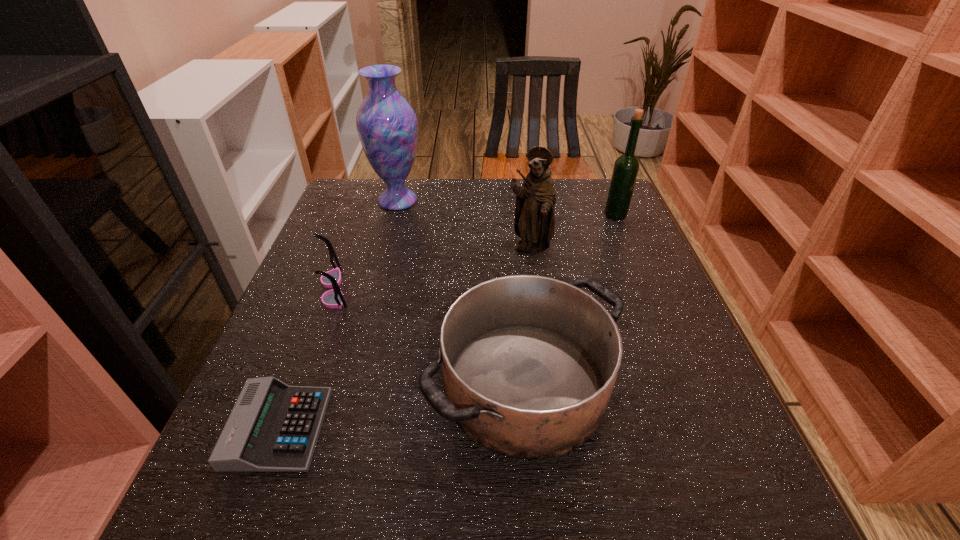
Where is `free region located on the back of the saucepan`? The height and width of the screenshot is (540, 960). free region located on the back of the saucepan is located at coordinates (516, 282).

The width and height of the screenshot is (960, 540). Identify the location of free location located on the right of the spectacles. [x=467, y=289].

You are a GUI agent. You are given a task and a screenshot of the screen. Output one action in this format:
    pyautogui.click(x=<x>, y=<y>)
    Task: Click on the vacant point located on the right of the calculator
    The width and height of the screenshot is (960, 540).
    Given the screenshot: What is the action you would take?
    pyautogui.click(x=566, y=428)

The image size is (960, 540). I want to click on vase at the far edge, so click(386, 123).

The image size is (960, 540). What are the coordinates of `liquor that is at the far edge` in the screenshot? It's located at (626, 167).

Find the location of a particular element. This screenshot has width=960, height=540. object at the near edge is located at coordinates click(x=273, y=427).

Locate an element on the screen. vase that is at the left edge is located at coordinates (386, 123).

Find the location of a particular element. The image size is (960, 540). spectacles located in the left edge section of the desktop is located at coordinates (333, 298).

Find the location of a particular element. The image size is (960, 540). calculator that is positioned at the left edge is located at coordinates click(x=273, y=427).

The height and width of the screenshot is (540, 960). What are the coordinates of `liquor at the right edge` in the screenshot? It's located at (626, 167).